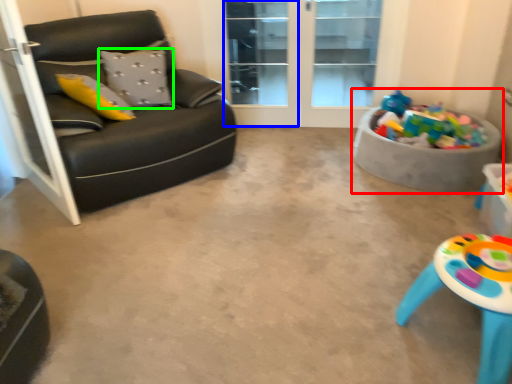
Question: Which is nearer to the toy (highlighted by a red box)? screen door (highlighted by a blue box) or pillow (highlighted by a green box).

Choices:
 (A) screen door
 (B) pillow

Answer: (A)